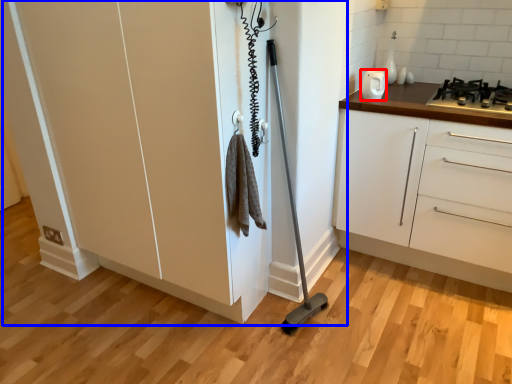
Question: Which object appears farthest to the camera in this image, home appliance (highlighted by a red box) or cupboard (highlighted by a blue box)?

Choices:
 (A) home appliance
 (B) cupboard

Answer: (A)